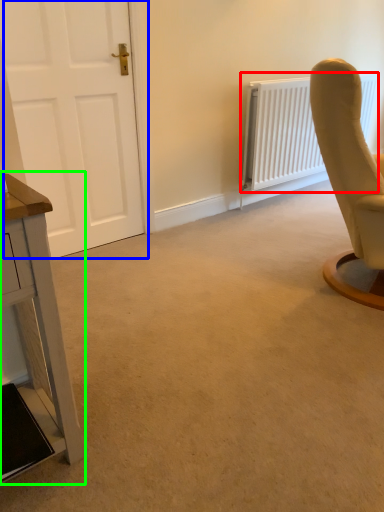
Question: Based on their relative distances, which object is farther from radiator (highlighted by a red box)? Choose from door (highlighted by a blue box) and table (highlighted by a green box).

Choices:
 (A) door
 (B) table

Answer: (B)